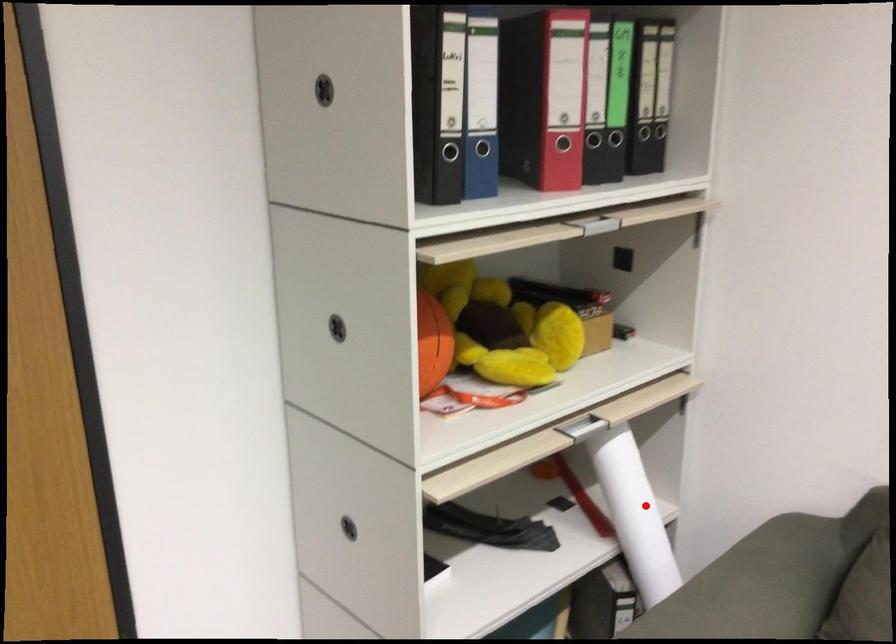
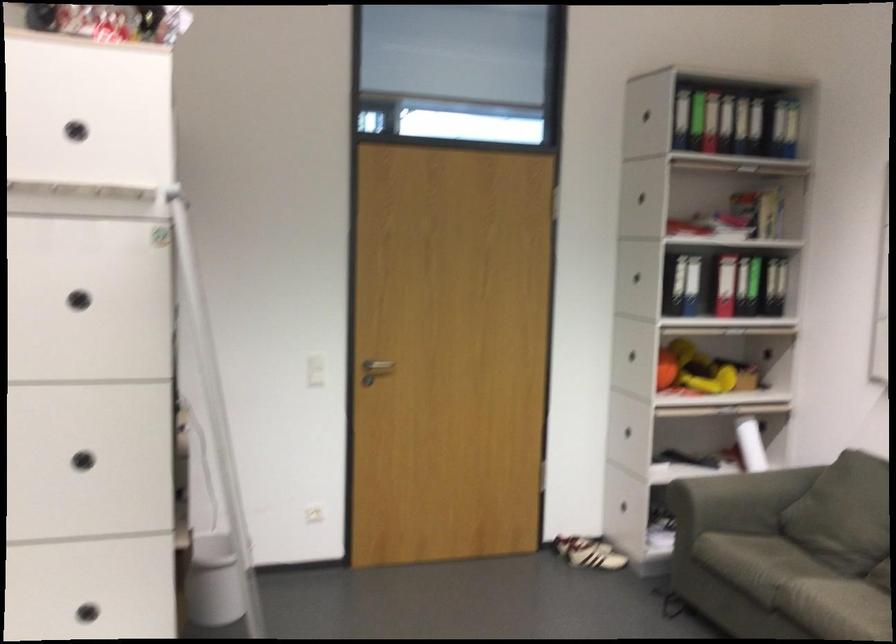
The point at the highlighted location is marked in the first image. Where is the corresponding point in the second image?

(750, 444)